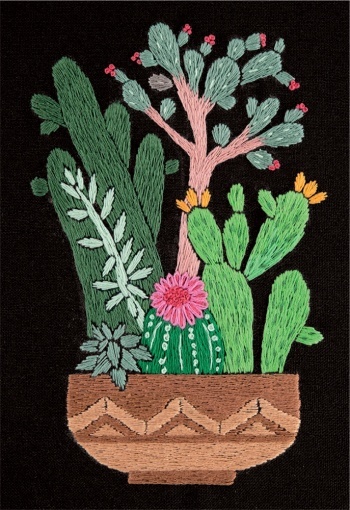
Locate an element on the screen. Image resolution: width=350 pixels, height=510 pixels. bottom of brown pot is located at coordinates (178, 480).